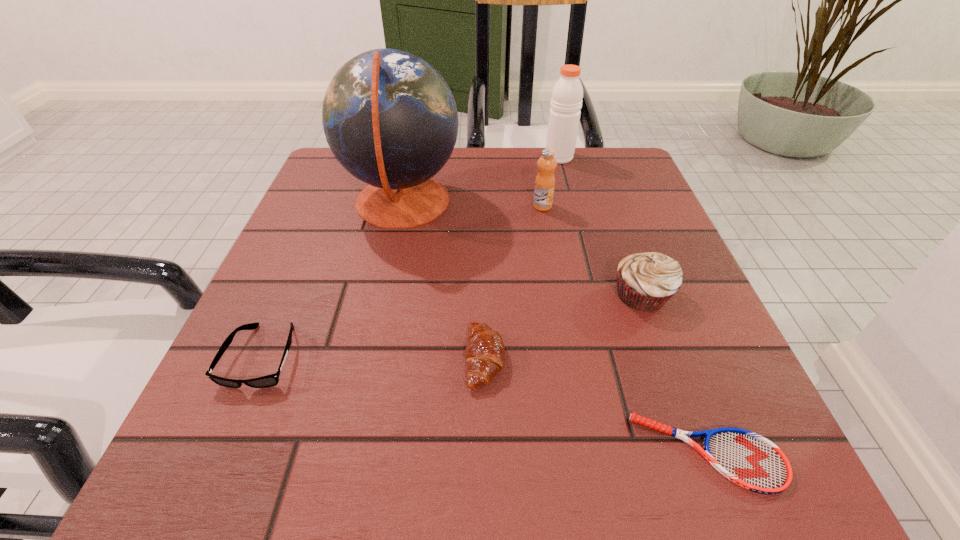
Identify the location of vacant point located between the fourth shortest object and the crescent roll. (564, 327).

Identify the location of free space between the crescent roll and the third tallest object. This screenshot has height=540, width=960. (514, 282).

At what (x,y) coordinates should I click in order to perform the action: click on free space between the third tallest object and the third object from left to right. Please return your answer as a coordinate pair (x, y). Looking at the image, I should click on (514, 282).

Find the location of a particular element. This screenshot has height=540, width=960. vacant region between the fourth farthest object and the nearest object is located at coordinates (675, 373).

Where is `vacant point located between the globe and the tennis racket`? This screenshot has height=540, width=960. vacant point located between the globe and the tennis racket is located at coordinates (555, 328).

Where is `vacant area between the tallest object and the orange juice`? The width and height of the screenshot is (960, 540). vacant area between the tallest object and the orange juice is located at coordinates (472, 205).

Identify the location of free spot between the tallest object and the shortest object. point(555,328).

At what (x,y) coordinates should I click in order to perform the action: click on unoccupied area between the shaker and the fifth tallest object. Please return your answer as a coordinate pair (x, y). Looking at the image, I should click on (522, 258).

This screenshot has width=960, height=540. Identify the location of the sixth closest object relative to the globe. (748, 459).

Find the location of a particular element. The height and width of the screenshot is (540, 960). object that stands as the third closest to the muffin is located at coordinates (545, 180).